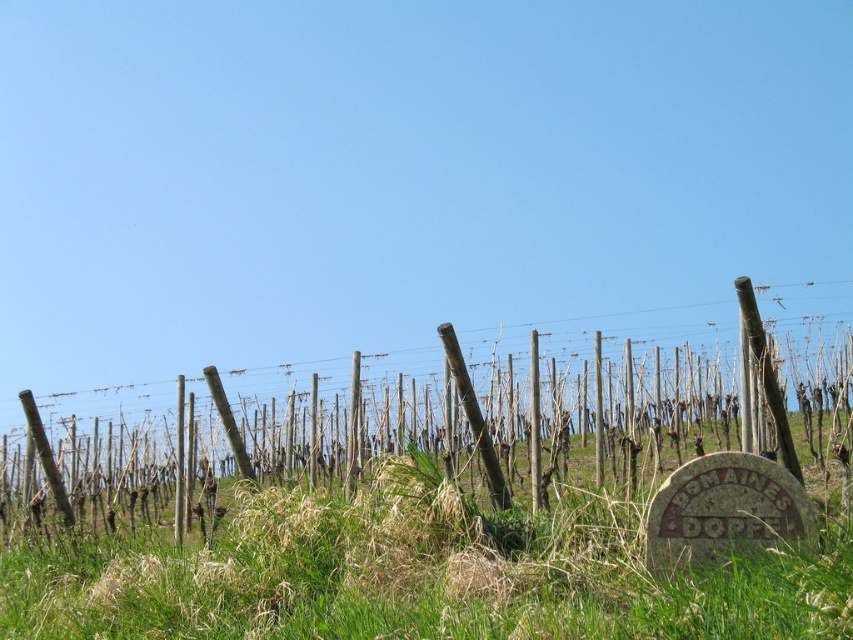
Measure the distance between green grassy at center and brown wooden posts at center.

7.42 meters

Does green grassy at center lie in front of brown wooden posts at center?

Yes.

Who is more distant from viewer, (345,509) or (216,460)?

Point (216,460)

This screenshot has width=853, height=640. Identify the location of green grassy at center. (419, 576).